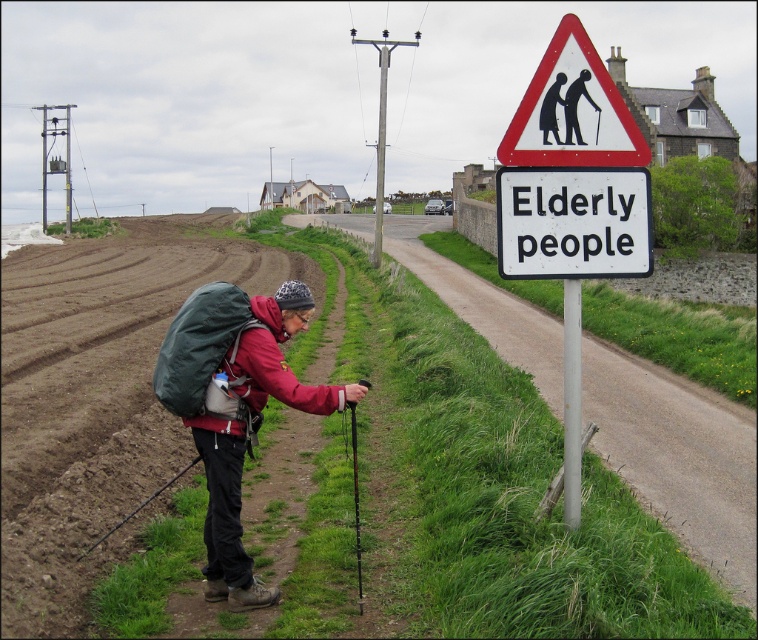
Which is below, black plastic cane at upper center or black fabric backpack at lower left?

black fabric backpack at lower left is lower down.

Can you confirm if black plastic cane at upper center is positioned to the left of black fabric backpack at lower left?

No, black plastic cane at upper center is not to the left of black fabric backpack at lower left.

Does point (592, 100) come in front of point (544, 115)?

No, (592, 100) is behind (544, 115).

Identify the location of black plastic cane at upper center. The height and width of the screenshot is (640, 758). (575, 106).

Which of these two, white plastic elderly people sign at upper right or black plastic cane at upper center, stands shorter?

With less height is black plastic cane at upper center.

Image resolution: width=758 pixels, height=640 pixels. Find the location of `white plastic elderly people sign at upper right`. white plastic elderly people sign at upper right is located at coordinates (572, 221).

Between red triangle sign at upper center and metallic pole at right, which one is positioned lower?

metallic pole at right

Between point (580, 83) and point (567, 436), which one is positioned behind?

Point (567, 436)

Where is `red triangle sign at upper center`? This screenshot has width=758, height=640. red triangle sign at upper center is located at coordinates (572, 112).